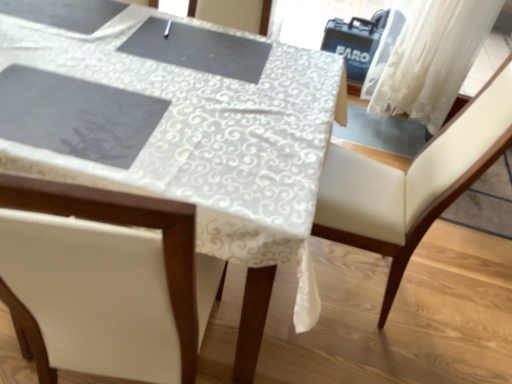
Question: Considering their positions, is white sheer curtain at upper right located in front of or behind white leather chair at center?

Choices:
 (A) behind
 (B) front

Answer: (A)

Question: Choose the correct answer: Is white sheer curtain at upper right inside white leather chair at center or outside it?

Choices:
 (A) inside
 (B) outside

Answer: (B)

Question: Which is nearer to the white lace tablecloth at center?

Choices:
 (A) white sheer curtain at upper right
 (B) white leather chair at center

Answer: (B)

Question: Based on their relative distances, which object is farther from the white leather chair at center?

Choices:
 (A) white sheer curtain at upper right
 (B) white lace tablecloth at center

Answer: (A)